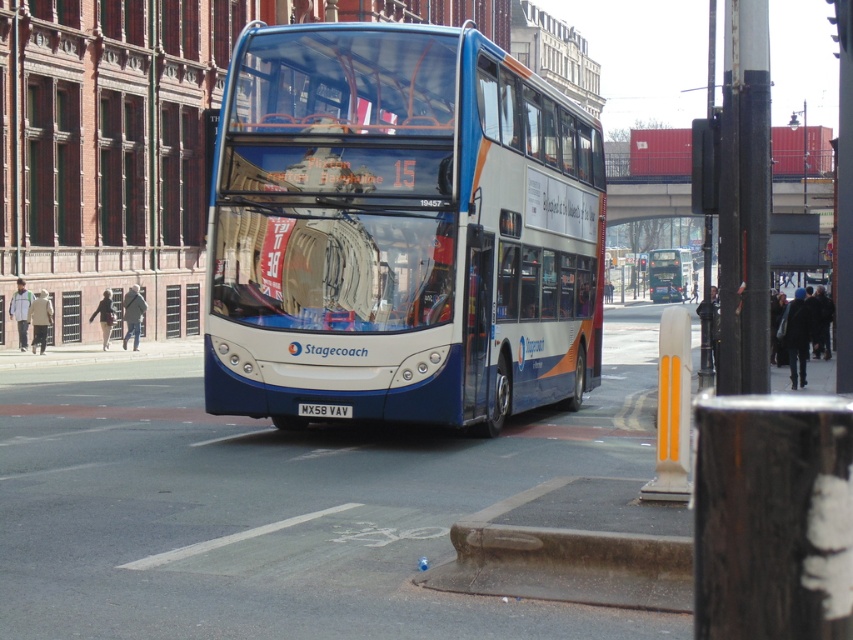
You are a pedestrian standing on the sidewalk and see the blue metallic bus at center and the black plastic license plate at center. Which object is closer to the left side of the image?

The black plastic license plate at center is closer to the left side of the image because the blue metallic bus at center is to the right of it.

You are standing on the city street and looking at the Stagecoach double decker bus. There are two points marked on the bus, one at point coordinates (422, 276) and the other at (318, 410). Which point is closer to you?

Point (422, 276) is closer to the viewer than point (318, 410).

You are a city planner analyzing traffic flow. You observe the blue metallic bus at center and the white glossy bus at center. Which bus would require a lower clearance height when passing under a bridge?

The blue metallic bus at center is shorter than the white glossy bus at center, so it would require a lower clearance height when passing under a bridge.